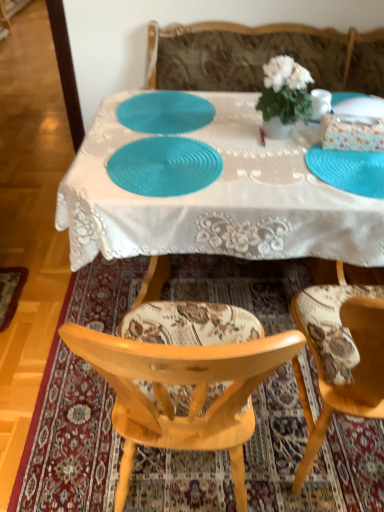
Locate an element on the screen. The image size is (384, 512). vacant space that is in between white matte flower pot at center and teal textured plate at center, acting as the 2th plate starting from the left is located at coordinates pyautogui.click(x=242, y=151).